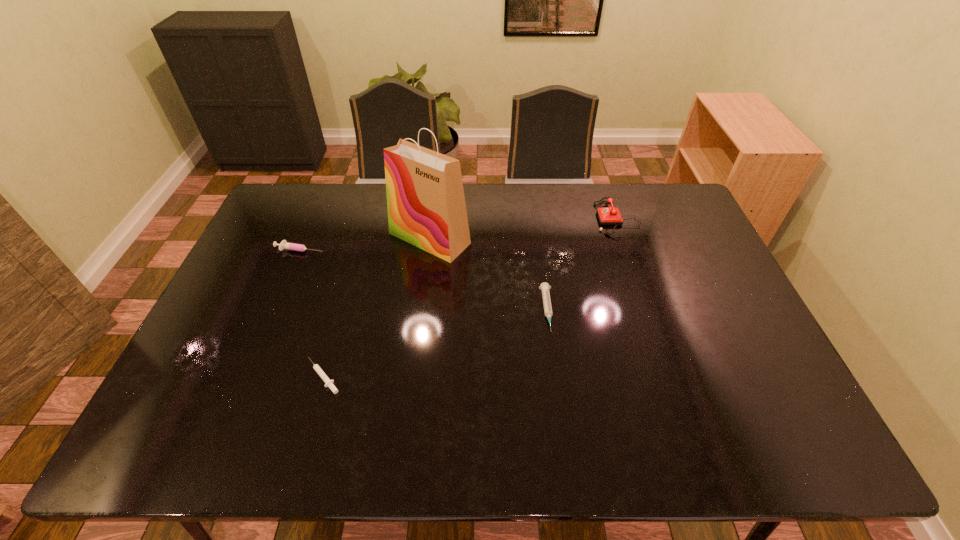
Where is `free space between the leftmost object and the shortest syringe`? Image resolution: width=960 pixels, height=540 pixels. free space between the leftmost object and the shortest syringe is located at coordinates (312, 313).

The height and width of the screenshot is (540, 960). I want to click on vacant region between the leftmost syringe and the shortest object, so click(312, 313).

What are the coordinates of `vacant space that is in between the tallest object and the telephone` in the screenshot? It's located at [523, 228].

The image size is (960, 540). Find the location of `free space between the second nearest syringe and the leftmost object`. free space between the second nearest syringe and the leftmost object is located at coordinates (424, 280).

Find the location of a particular element. The image size is (960, 540). vacant space that's between the tallest object and the shortest syringe is located at coordinates (376, 307).

Select which object is the second closest to the nearest syringe. Please provide its 2D coordinates. Your answer should be formatted as a tuple, i.e. [(x, y)], where the tuple contains the x and y coordinates of a point satisfying the conditions above.

[(284, 244)]

Point out which object is positioned as the third nearest to the nearest syringe. Please provide its 2D coordinates. Your answer should be formatted as a tuple, i.e. [(x, y)], where the tuple contains the x and y coordinates of a point satisfying the conditions above.

[(545, 287)]

Locate which syringe ranks in proximity to the leftmost object. Please provide its 2D coordinates. Your answer should be formatted as a tuple, i.e. [(x, y)], where the tuple contains the x and y coordinates of a point satisfying the conditions above.

[(329, 383)]

Where is `the second closest syringe relative to the rightmost syringe`? This screenshot has height=540, width=960. the second closest syringe relative to the rightmost syringe is located at coordinates click(x=284, y=244).

Where is `blank area in the image that satisfies the following two spatial constraints: 1. on the back side of the leftmost syringe; 2. on the left side of the third object from right to left`? This screenshot has height=540, width=960. blank area in the image that satisfies the following two spatial constraints: 1. on the back side of the leftmost syringe; 2. on the left side of the third object from right to left is located at coordinates (305, 238).